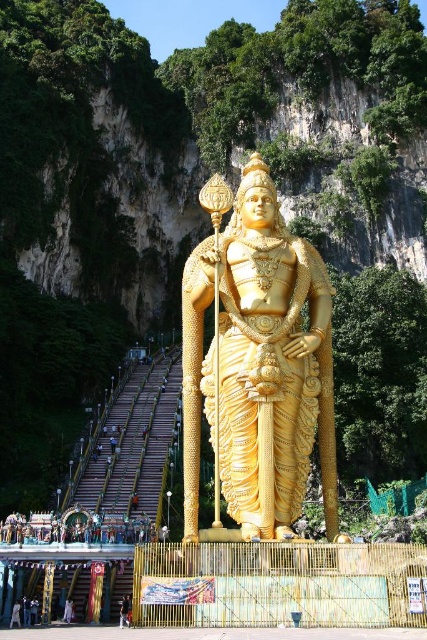
You are a tourist standing at the base of the staircase leading up to Batu Caves. You see the golden statue of Lord Murugan at the center. Where exactly is the point located at coordinates (259, 365) in relation to the statue?

The point at coordinates (259, 365) corresponds to the golden polished statue at center.

You are a tourist standing at the base of the Batu Caves staircase. You notice two visitors wearing dark blue jeans at lower center and light brown fabric pants at lower left. Which visitor is positioned closer to the right side of the staircase?

The dark blue jeans at lower center is positioned to the right of the light brown fabric pants at lower left, so the visitor wearing dark blue jeans at lower center is closer to the right side of the staircase.

You are a tourist standing at the base of the staircase leading to Batu Caves. You see the golden polished statue at center and the light gray fabric person at lower left. Which object is closer to you?

The golden polished statue at center is closer to you because it is in front of the light gray fabric person at lower left.